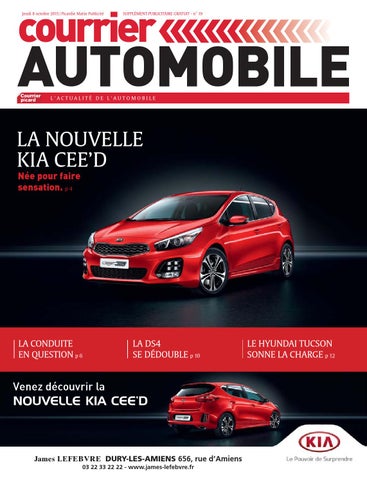
The height and width of the screenshot is (480, 367). Identify the location of side window. (230, 390), (253, 395), (243, 208), (262, 207).